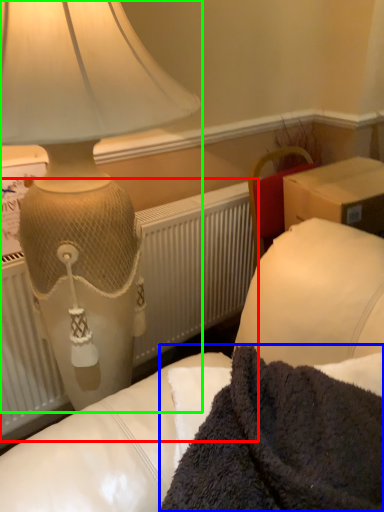
Question: Considering the real-world distances, which object is farthest from radiator (highlighted by a red box)? blanket (highlighted by a blue box) or lamp (highlighted by a green box)?

Choices:
 (A) blanket
 (B) lamp

Answer: (A)